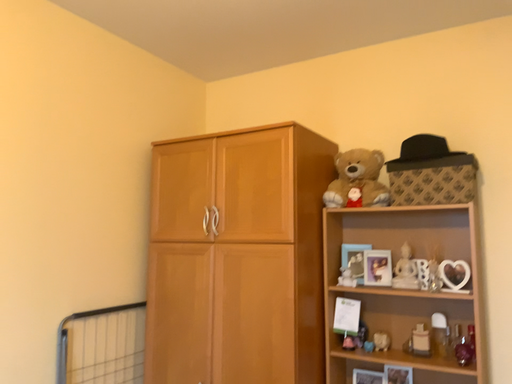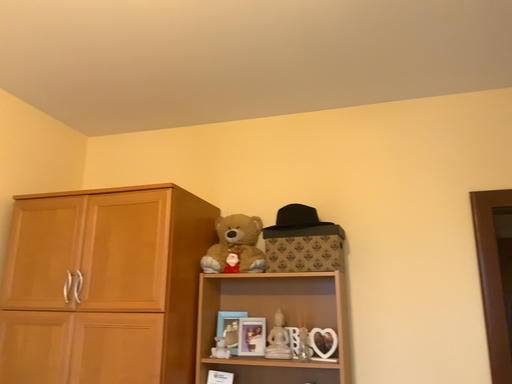
Question: Which way did the camera rotate in the video?

Choices:
 (A) rotated downward
 (B) rotated upward

Answer: (B)